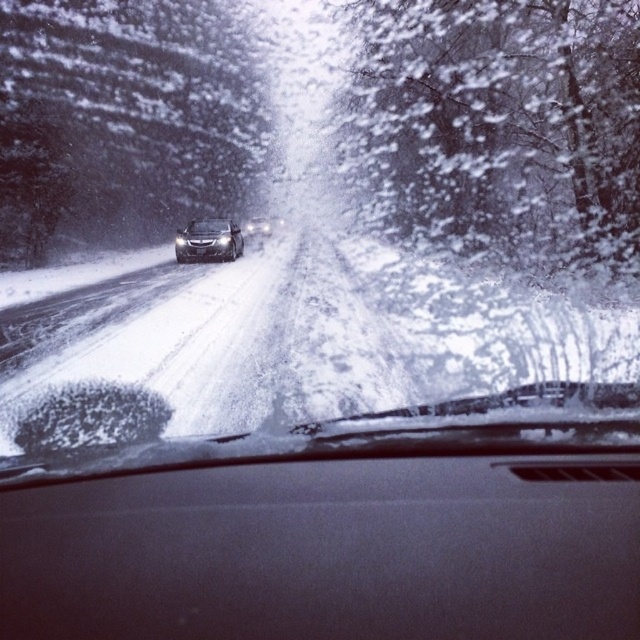
You are driving a car and want to check your speedometer. Since you can see the transparent glass windshield at center and the satin black dashboard at center, which object is closer to you so you can see the speedometer?

The satin black dashboard at center is behind the transparent glass windshield at center, so the transparent glass windshield at center is closer to you. Therefore, you can see the speedometer on the satin black dashboard at center through the windshield.

You are driving a car and want to make sure your transparent glass windshield at center can fully cover the sleek silver sedan at center to protect it from snow. Is this possible based on their sizes?

The transparent glass windshield at center might be wider than the sleek silver sedan at center, so it could potentially cover it fully depending on the exact dimensions.

In the scene shown: You are driving in a snowstorm and need to ensure your visibility. The transparent glass windshield at center and the satin black dashboard at center are both in your line of sight. Which object is taller and might obstruct your view more?

The transparent glass windshield at center is taller than the satin black dashboard at center, so it might obstruct your view more.